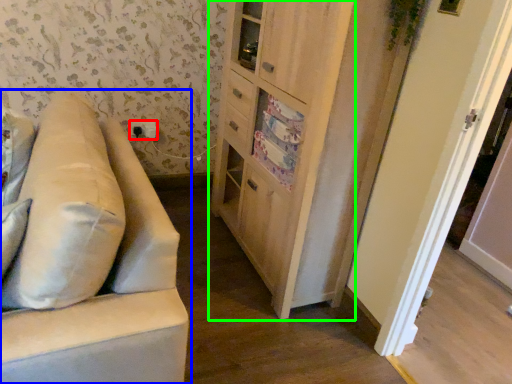
Question: Which is farther away from electric outlet (highlighted by a red box)? studio couch (highlighted by a blue box) or cabinetry (highlighted by a green box)?

Choices:
 (A) studio couch
 (B) cabinetry

Answer: (A)